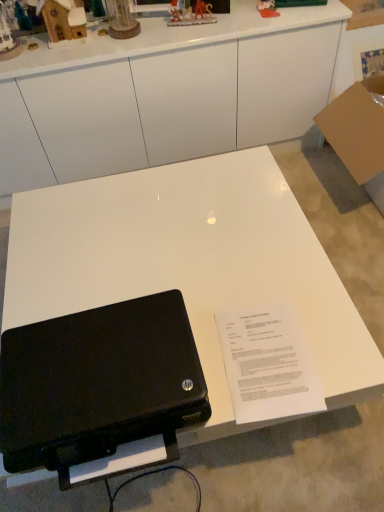
Where is `vacant area situated to the left side of metallic silver sleigh at upper center, placed as the second toy when sorted from right to left`? This screenshot has height=512, width=384. vacant area situated to the left side of metallic silver sleigh at upper center, placed as the second toy when sorted from right to left is located at coordinates (155, 28).